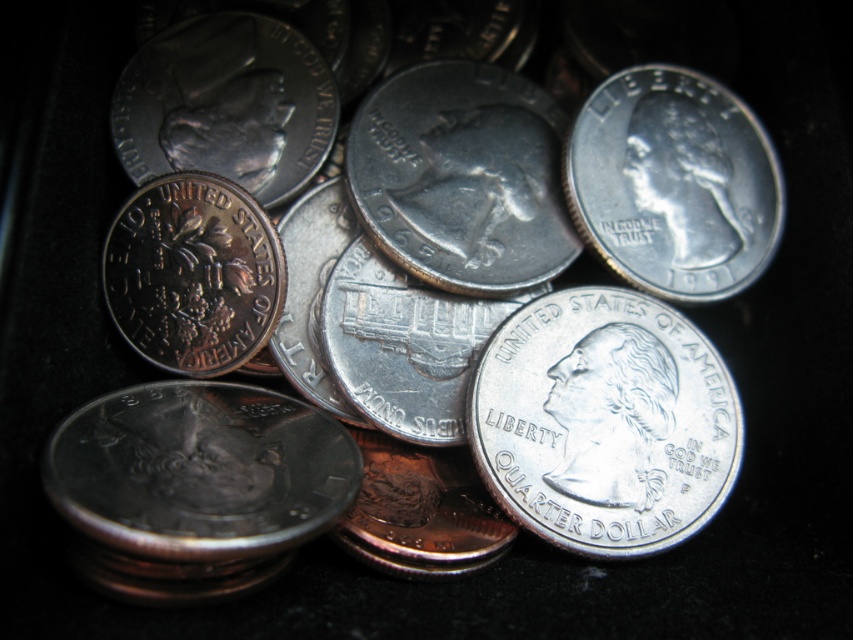
You are a coin collector examining the image. You notice a point labeled at coordinates [604,422]. Which coin does this point correspond to?

The point at coordinates [604,422] corresponds to the silver reflective quarter dollar at center.